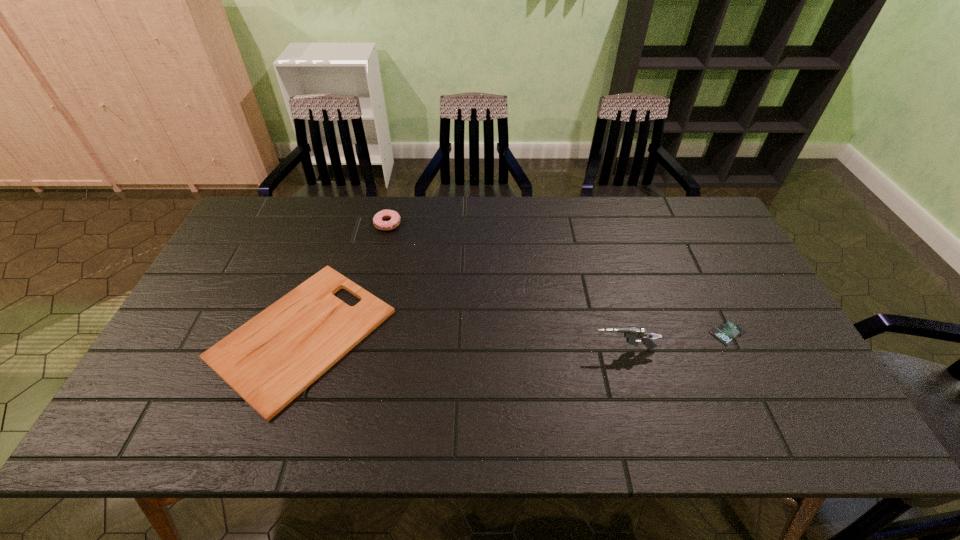
I want to click on free space located on the right of the doughnut, so click(x=508, y=224).

You are a GUI agent. You are given a task and a screenshot of the screen. Output one action in this format:
    pyautogui.click(x=<x>, y=<y>)
    Task: Click on the free space located 0.230m on the back of the third tallest object
    This screenshot has height=540, width=960.
    Given the screenshot: What is the action you would take?
    pyautogui.click(x=342, y=221)

Identify the location of blank space located on the front of the shortest object. The image size is (960, 540). (742, 363).

The width and height of the screenshot is (960, 540). Find the location of `object situated at the far edge`. object situated at the far edge is located at coordinates (378, 222).

Image resolution: width=960 pixels, height=540 pixels. Identify the location of object that is positioned at the near edge. pos(271,359).

Identify the location of object at the left edge. (271, 359).

Where is `object that is positioned at the right edge`? object that is positioned at the right edge is located at coordinates (727, 331).

Locate an element on the screen. The height and width of the screenshot is (540, 960). object that is at the near left corner is located at coordinates (271, 359).

Identify the location of vacant space at the far edge of the desktop. (449, 222).

Find the location of `vacant space at the near edge of the desktop`. vacant space at the near edge of the desktop is located at coordinates (460, 429).